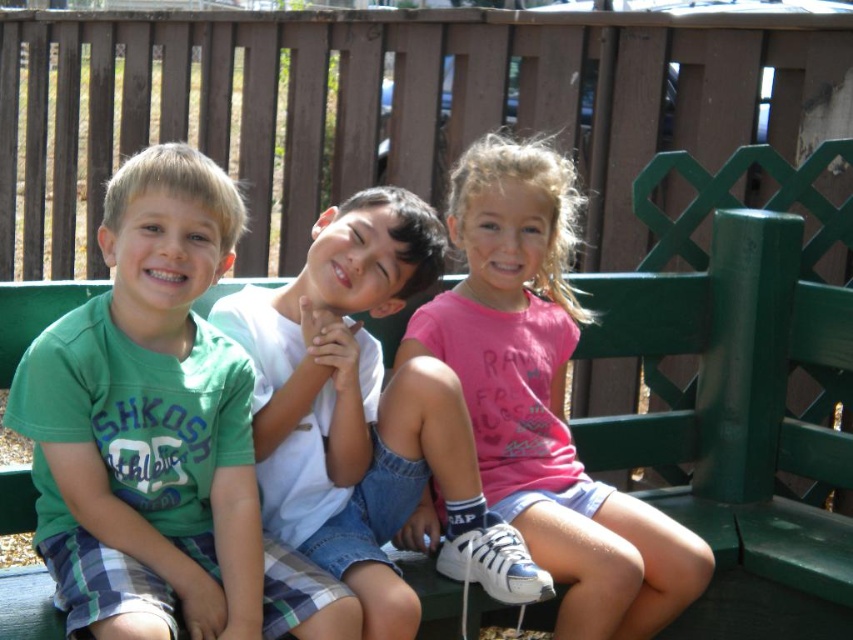
Describe the element at coordinates (160, 435) in the screenshot. This screenshot has height=640, width=853. I see `green cotton shirt at left` at that location.

Between point (38, 417) and point (746, 625), which one is positioned behind?

The point (746, 625) is more distant.

Identify the location of green cotton shirt at left. pyautogui.click(x=160, y=435).

This screenshot has height=640, width=853. I want to click on green cotton shirt at left, so click(x=160, y=435).

Between green wood bench at center and white cotton shirt at center, which one has more height?

With more height is green wood bench at center.

Is green wood bench at center shorter than white cotton shirt at center?

No, green wood bench at center is not shorter than white cotton shirt at center.

Describe the element at coordinates (737, 422) in the screenshot. The height and width of the screenshot is (640, 853). I see `green wood bench at center` at that location.

This screenshot has height=640, width=853. Identify the location of green wood bench at center. (737, 422).

Can you confirm if green cotton shirt at left is shorter than white cotton shirt at center?

No, green cotton shirt at left is not shorter than white cotton shirt at center.

Who is more distant from viewer, (x=49, y=570) or (x=408, y=432)?

The point (x=408, y=432) is behind.

Identify the location of green cotton shirt at left. (160, 435).

At what (x,y) coordinates should I click in order to perform the action: click on green cotton shirt at left. Please return your answer as a coordinate pair (x, y). This screenshot has width=853, height=640. Looking at the image, I should click on (160, 435).